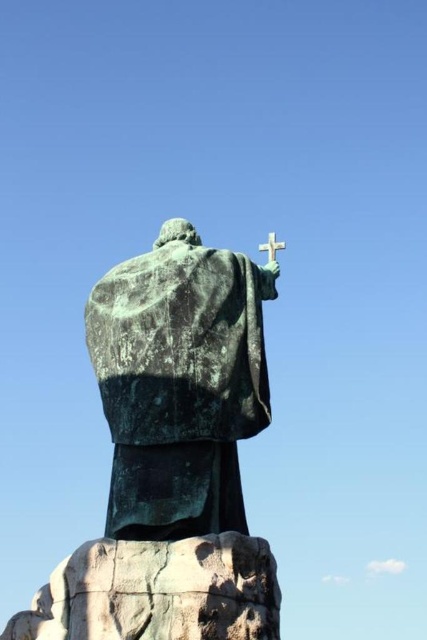
Question: Is green patina statue at center to the right of white matte cross at upper center from the viewer's perspective?

Choices:
 (A) no
 (B) yes

Answer: (A)

Question: Among these objects, which one is farthest from the camera?

Choices:
 (A) white matte cross at upper center
 (B) green patina statue at center

Answer: (A)

Question: Can you confirm if green patina statue at center is smaller than white matte cross at upper center?

Choices:
 (A) yes
 (B) no

Answer: (B)

Question: Which of the following is the closest to the observer?

Choices:
 (A) click(131, 289)
 (B) click(283, 248)

Answer: (A)

Question: Does green patina statue at center appear on the left side of white matte cross at upper center?

Choices:
 (A) no
 (B) yes

Answer: (B)